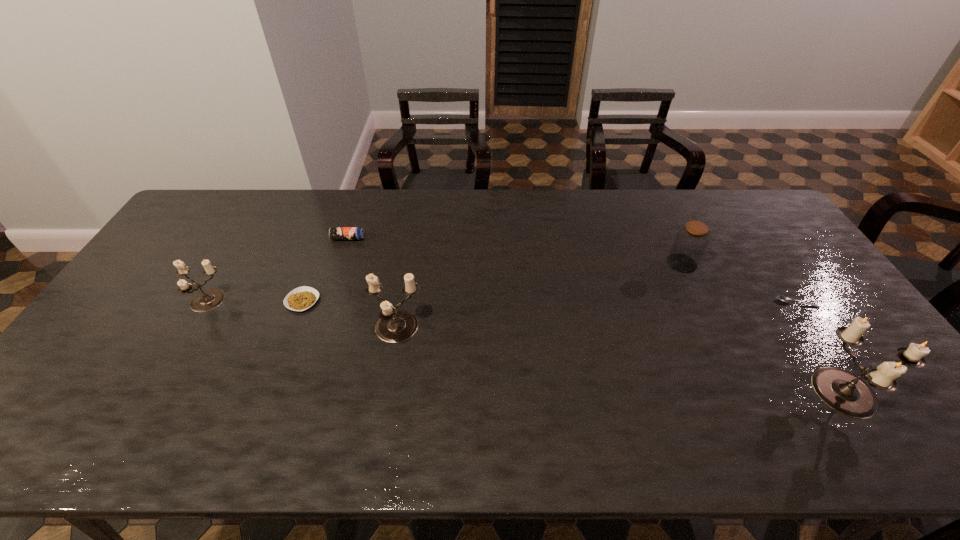
I want to click on the shortest candle holder, so click(209, 299).

Find the location of `the leftmost object`. the leftmost object is located at coordinates (209, 299).

At what (x,y) coordinates should I click in order to perform the action: click on the second tallest object. Please return your answer as a coordinate pair (x, y). The width and height of the screenshot is (960, 540). Looking at the image, I should click on (394, 326).

Image resolution: width=960 pixels, height=540 pixels. I want to click on the fourth object from left to right, so click(x=394, y=326).

This screenshot has height=540, width=960. Find the location of `the tallest candle holder`. the tallest candle holder is located at coordinates (844, 392).

At what (x,y) coordinates should I click in order to perform the action: click on the nearest candle holder. Please return your answer as a coordinate pair (x, y). This screenshot has width=960, height=540. Looking at the image, I should click on (844, 392).

You are a GUI agent. You are given a task and a screenshot of the screen. Output one action in this format:
    pyautogui.click(x=<x>, y=<y>)
    Task: Click on the beer can
    The height and width of the screenshot is (540, 960).
    Given the screenshot: What is the action you would take?
    pyautogui.click(x=335, y=233)

Where is `the third shortest object`? This screenshot has width=960, height=540. the third shortest object is located at coordinates (335, 233).

Image resolution: width=960 pixels, height=540 pixels. I want to click on the second farthest object, so click(x=690, y=243).

Find the location of `the third object from right to left`. the third object from right to left is located at coordinates (690, 243).